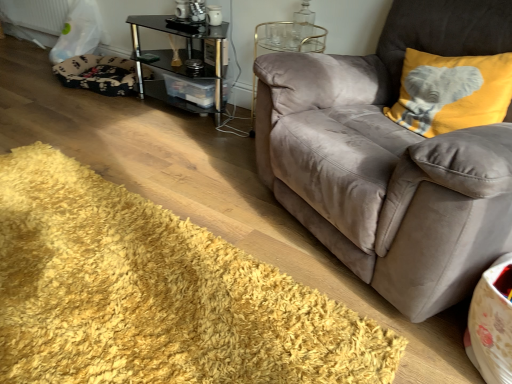
Question: From the image's perspective, is yellow shaggy rug at lower left located above fluffy black and white dog bed at lower left?

Choices:
 (A) no
 (B) yes

Answer: (A)

Question: Can you confirm if yellow shaggy rug at lower left is wider than fluffy black and white dog bed at lower left?

Choices:
 (A) no
 (B) yes

Answer: (B)

Question: Considering the relative sizes of yellow shaggy rug at lower left and fluffy black and white dog bed at lower left in the image provided, is yellow shaggy rug at lower left thinner than fluffy black and white dog bed at lower left?

Choices:
 (A) no
 (B) yes

Answer: (A)

Question: Is yellow shaggy rug at lower left surrounding fluffy black and white dog bed at lower left?

Choices:
 (A) no
 (B) yes

Answer: (A)

Question: From a real-world perspective, is yellow shaggy rug at lower left located beneath fluffy black and white dog bed at lower left?

Choices:
 (A) yes
 (B) no

Answer: (A)

Question: Is yellow shaggy rug at lower left in front of or behind black glass table at center in the image?

Choices:
 (A) behind
 (B) front

Answer: (B)

Question: Would you say yellow shaggy rug at lower left is to the left or to the right of black glass table at center in the picture?

Choices:
 (A) left
 (B) right

Answer: (A)

Question: From their relative heights in the image, would you say yellow shaggy rug at lower left is taller or shorter than black glass table at center?

Choices:
 (A) short
 (B) tall

Answer: (A)

Question: Considering the positions of yellow shaggy rug at lower left and black glass table at center in the image, is yellow shaggy rug at lower left wider or thinner than black glass table at center?

Choices:
 (A) wide
 (B) thin

Answer: (A)

Question: In terms of size, does black glass table at center appear bigger or smaller than fluffy black and white dog bed at lower left?

Choices:
 (A) small
 (B) big

Answer: (B)

Question: Is black glass table at center in front of or behind fluffy black and white dog bed at lower left in the image?

Choices:
 (A) behind
 (B) front

Answer: (B)

Question: Is black glass table at center taller or shorter than fluffy black and white dog bed at lower left?

Choices:
 (A) short
 (B) tall

Answer: (B)

Question: From the image's perspective, is black glass table at center located above or below fluffy black and white dog bed at lower left?

Choices:
 (A) above
 (B) below

Answer: (B)

Question: Is yellow shaggy rug at lower left inside the boundaries of fluffy black and white dog bed at lower left, or outside?

Choices:
 (A) outside
 (B) inside

Answer: (A)

Question: From a real-world perspective, is yellow shaggy rug at lower left positioned above or below fluffy black and white dog bed at lower left?

Choices:
 (A) above
 (B) below

Answer: (B)